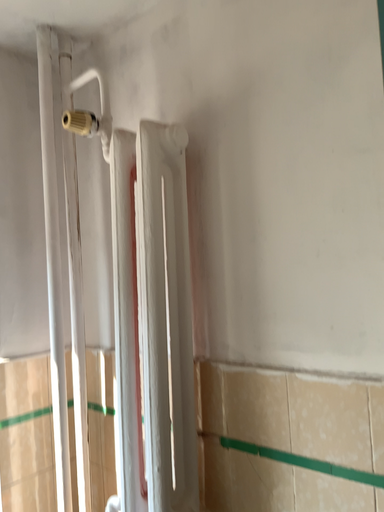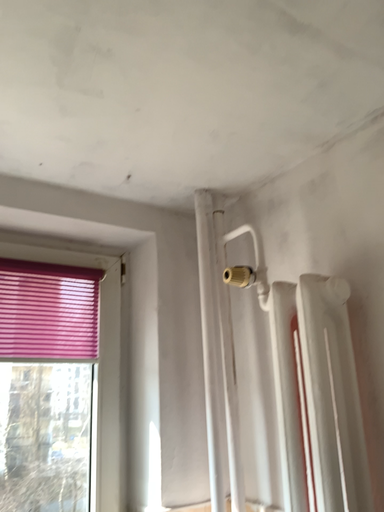
Question: Which way did the camera rotate in the video?

Choices:
 (A) rotated right
 (B) rotated left

Answer: (B)